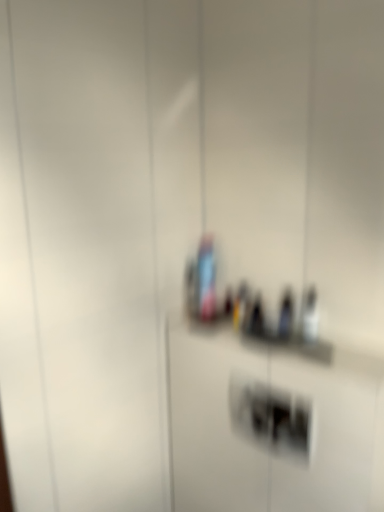
Question: From a real-world perspective, is white plastic light switch at center positioned over translucent glass bottle at center based on gravity?

Choices:
 (A) no
 (B) yes

Answer: (A)

Question: Is translucent glass bottle at center a part of white plastic light switch at center?

Choices:
 (A) no
 (B) yes

Answer: (A)

Question: Is white plastic light switch at center to the left of translucent glass bottle at center from the viewer's perspective?

Choices:
 (A) yes
 (B) no

Answer: (B)

Question: Is white plastic light switch at center far from translucent glass bottle at center?

Choices:
 (A) yes
 (B) no

Answer: (B)

Question: Does white plastic light switch at center lie in front of translucent glass bottle at center?

Choices:
 (A) yes
 (B) no

Answer: (A)

Question: Is the position of white plastic light switch at center more distant than that of translucent glass bottle at center?

Choices:
 (A) yes
 (B) no

Answer: (B)

Question: Is translucent glass bottle at center behind white plastic light switch at center?

Choices:
 (A) no
 (B) yes

Answer: (B)

Question: From a real-world perspective, is translucent glass bottle at center beneath white plastic light switch at center?

Choices:
 (A) no
 (B) yes

Answer: (A)

Question: Is translucent glass bottle at center placed right next to white plastic light switch at center?

Choices:
 (A) no
 (B) yes

Answer: (A)

Question: Can white plastic light switch at center be found inside translucent glass bottle at center?

Choices:
 (A) yes
 (B) no

Answer: (B)

Question: From the image's perspective, is translucent glass bottle at center below white plastic light switch at center?

Choices:
 (A) no
 (B) yes

Answer: (A)

Question: Does translucent glass bottle at center have a greater width compared to white plastic light switch at center?

Choices:
 (A) no
 (B) yes

Answer: (B)

Question: From the image's perspective, is white plastic light switch at center located above or below translucent glass bottle at center?

Choices:
 (A) above
 (B) below

Answer: (B)